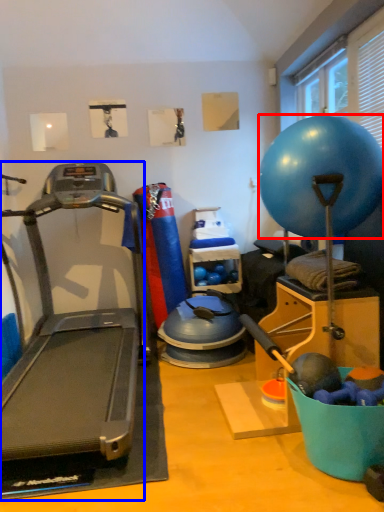
Question: Which point is closer to the camera, ball (highlighted by a red box) or treadmill (highlighted by a blue box)?

Choices:
 (A) ball
 (B) treadmill

Answer: (B)